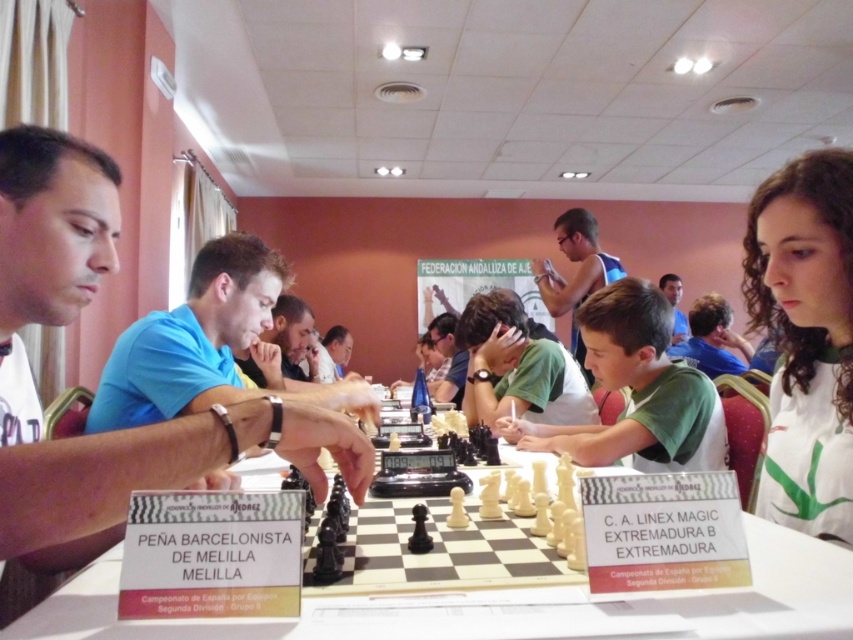
You are a photographer at the chess tournament and want to take a photo of both the white shirt at left and the blue shirt at center. However, you can only focus on one of them clearly. Which one should you focus on to ensure the other is still somewhat in focus?

You should focus on the blue shirt at center because it is closer to the camera than the white shirt at left, so focusing on the closer subject will keep the background subject somewhat in focus.

In the scene shown: You are a photographer at the chess tournament and need to capture a clear photo of both the white shirt at left and the white plastic chessboard at center. However, the lighting is causing some glare on the chessboard. Which object should you adjust your camera angle to focus on first to ensure both are visible?

The white shirt at left is positioned over the white plastic chessboard at center, so adjusting the camera angle to focus on the white plastic chessboard at center first would help ensure both are visible without glare overlapping.